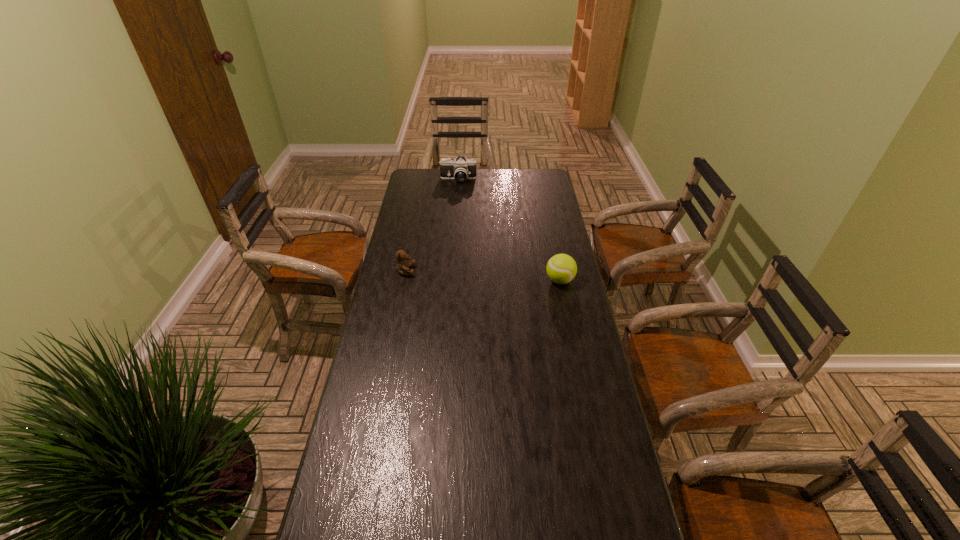
Find the location of a particular element. the second object from right to left is located at coordinates (460, 169).

Identify the location of the farthest object. This screenshot has height=540, width=960. (460, 169).

This screenshot has width=960, height=540. I want to click on the rightmost object, so click(x=561, y=268).

The width and height of the screenshot is (960, 540). In order to click on teddy bear in this screenshot , I will do `click(403, 266)`.

I want to click on free point located on the front of the farthest object, so click(x=455, y=220).

Find the location of a particular element. This screenshot has width=960, height=540. free space located 0.300m on the front of the tennis ball is located at coordinates (575, 353).

Locate an element on the screen. This screenshot has height=540, width=960. vacant space located 0.330m on the front-facing side of the leftmost object is located at coordinates (499, 271).

Locate an element on the screen. The width and height of the screenshot is (960, 540). object situated at the far edge is located at coordinates (460, 169).

I want to click on object that is positioned at the left edge, so click(x=403, y=266).

Identify the location of object present at the right edge. The width and height of the screenshot is (960, 540). (561, 268).